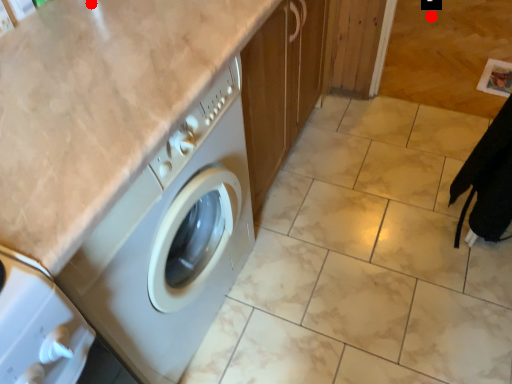
Question: Two points are circled on the image, labeled by A and B beside each circle. Which of the following is the farthest from the observer?

Choices:
 (A) A is further
 (B) B is further

Answer: (B)